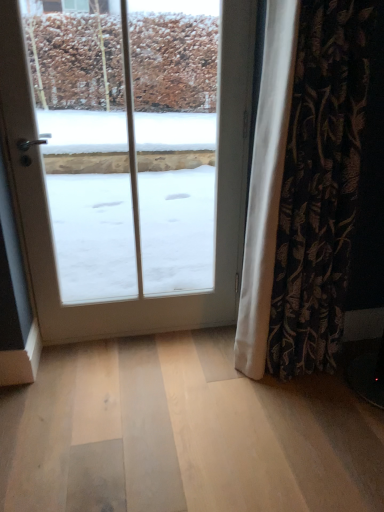
Question: From a real-world perspective, is black floral fabric curtain at right physically below white glass door at center?

Choices:
 (A) yes
 (B) no

Answer: (A)

Question: From the image's perspective, is black floral fabric curtain at right above white glass door at center?

Choices:
 (A) yes
 (B) no

Answer: (B)

Question: Can you confirm if black floral fabric curtain at right is wider than white glass door at center?

Choices:
 (A) no
 (B) yes

Answer: (B)

Question: Is black floral fabric curtain at right at the right side of white glass door at center?

Choices:
 (A) yes
 (B) no

Answer: (A)

Question: Can you confirm if black floral fabric curtain at right is shorter than white glass door at center?

Choices:
 (A) no
 (B) yes

Answer: (B)

Question: Is black floral fabric curtain at right next to white glass door at center?

Choices:
 (A) yes
 (B) no

Answer: (B)

Question: Can you confirm if white glass door at center is wider than black floral fabric curtain at right?

Choices:
 (A) no
 (B) yes

Answer: (A)

Question: Could you tell me if white glass door at center is turned towards black floral fabric curtain at right?

Choices:
 (A) no
 (B) yes

Answer: (A)

Question: Is white glass door at center not within black floral fabric curtain at right?

Choices:
 (A) yes
 (B) no

Answer: (A)

Question: Can you confirm if white glass door at center is bigger than black floral fabric curtain at right?

Choices:
 (A) no
 (B) yes

Answer: (A)

Question: Considering the relative positions of white glass door at center and black floral fabric curtain at right in the image provided, is white glass door at center to the right of black floral fabric curtain at right from the viewer's perspective?

Choices:
 (A) no
 (B) yes

Answer: (A)

Question: From the image's perspective, is white glass door at center above black floral fabric curtain at right?

Choices:
 (A) yes
 (B) no

Answer: (A)

Question: Looking at their shapes, would you say black floral fabric curtain at right is wider or thinner than white glass door at center?

Choices:
 (A) wide
 (B) thin

Answer: (A)